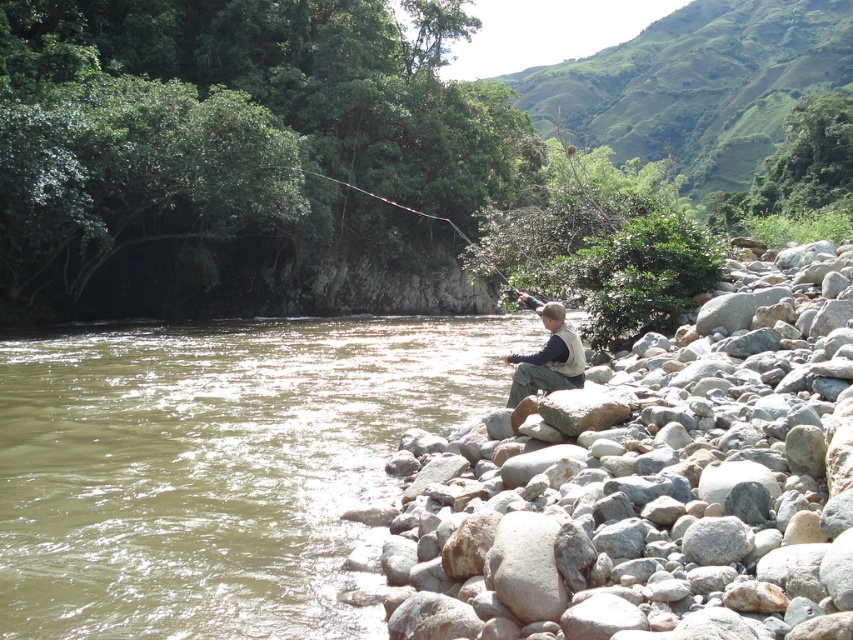
Question: Which object is positioned farthest from the greenish water at lower left?

Choices:
 (A) smooth brown fishing rod at upper center
 (B) light brown fabric vest at center
 (C) gray smooth rock at right

Answer: (A)

Question: Can you confirm if greenish water at lower left is wider than light brown fabric vest at center?

Choices:
 (A) no
 (B) yes

Answer: (B)

Question: Which point is closer to the camera taking this photo?

Choices:
 (A) (231, 182)
 (B) (621, 556)
 (C) (283, 372)

Answer: (B)

Question: Which is nearer to the greenish water at lower left?

Choices:
 (A) smooth brown fishing rod at upper center
 (B) light brown fabric vest at center

Answer: (B)

Question: Considering the relative positions of light brown fabric vest at center and smooth brown fishing rod at upper center in the image provided, where is light brown fabric vest at center located with respect to smooth brown fishing rod at upper center?

Choices:
 (A) above
 (B) below

Answer: (B)

Question: Considering the relative positions of greenish water at lower left and smooth brown fishing rod at upper center in the image provided, where is greenish water at lower left located with respect to smooth brown fishing rod at upper center?

Choices:
 (A) right
 (B) left

Answer: (A)